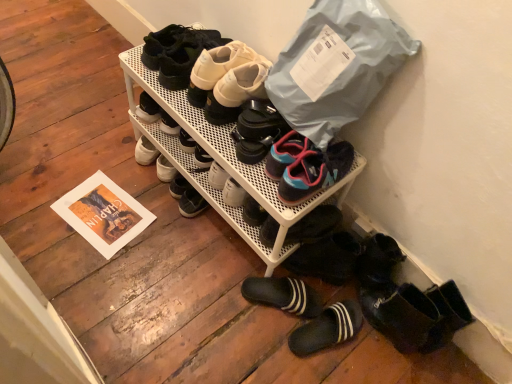
At what (x,y) coordinates should I click in order to perform the action: click on free area in between black rubber slippers at lower center, the 1th footwear in the bottom-to-top sequence, and black rubber slipper at lower center, which is the second footwear from bottom to top. Please return your answer as a coordinate pair (x, y). This screenshot has width=512, height=384. Looking at the image, I should click on (266, 315).